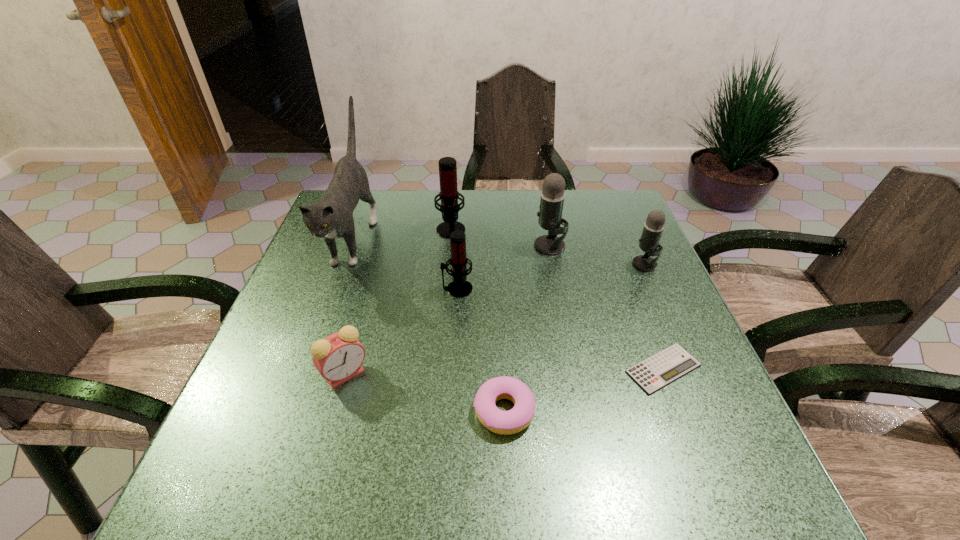
Locate an element on the screen. The width and height of the screenshot is (960, 540). cat is located at coordinates (332, 217).

You are a GUI agent. You are given a task and a screenshot of the screen. Output one action in this format:
    pyautogui.click(x=<x>, y=<y>)
    Task: Click on the bigger red microphone
    The height and width of the screenshot is (540, 960).
    Given the screenshot: What is the action you would take?
    pyautogui.click(x=449, y=195)

This screenshot has width=960, height=540. Find the location of `the bigger gray microphone`. the bigger gray microphone is located at coordinates (552, 196).

Find the location of a particular element. Image resolution: width=960 pixels, height=540 pixels. the third object from right to left is located at coordinates (552, 196).

You are a GUI agent. You are given a task and a screenshot of the screen. Output one action in this format:
    pyautogui.click(x=<x>, y=<y>)
    Task: Click on the smaller gray microphone
    The image size is (960, 540).
    Given the screenshot: What is the action you would take?
    pyautogui.click(x=652, y=231)

This screenshot has width=960, height=540. I want to click on the right gray microphone, so click(x=652, y=231).

Locate an element on the screen. Image resolution: width=960 pixels, height=540 pixels. the nearest microphone is located at coordinates (459, 287).

In order to click on the nearer red microphone in this screenshot , I will do `click(459, 287)`.

Where is `the third shortest object`? the third shortest object is located at coordinates (339, 357).

I want to click on alarm clock, so click(339, 357).